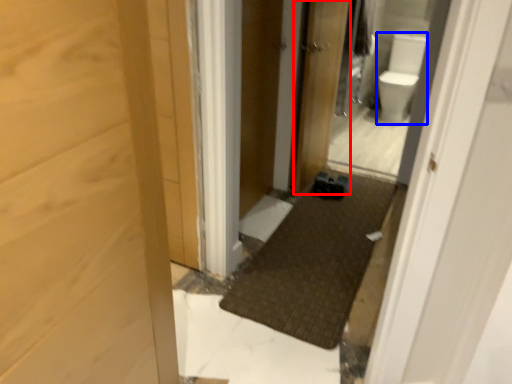
Question: Among these objects, which one is farthest to the camera, door (highlighted by a red box) or toilet bowl (highlighted by a blue box)?

Choices:
 (A) door
 (B) toilet bowl

Answer: (B)